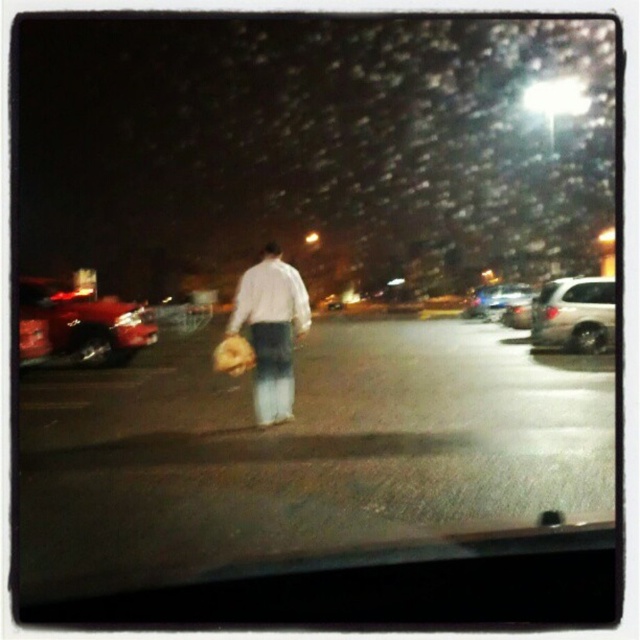
Question: Which point is closer to the camera taking this photo?

Choices:
 (A) (506, 321)
 (B) (556, 337)
 (C) (300, 296)
 (D) (20, 304)

Answer: (C)

Question: Estimate the real-world distances between objects in this image. Which object is farther from the satin silver suv at right?

Choices:
 (A) shiny red car at left
 (B) metallic silver sedan at right

Answer: (A)

Question: Which of the following is the closest to the observer?

Choices:
 (A) (548, 301)
 (B) (518, 310)
 (C) (32, 314)

Answer: (C)

Question: Is satin silver suv at right thinner than metallic silver sedan at right?

Choices:
 (A) yes
 (B) no

Answer: (B)

Question: Is the position of shiny red car at left less distant than that of satin silver suv at right?

Choices:
 (A) no
 (B) yes

Answer: (B)

Question: Can you confirm if shiny red car at left is smaller than satin silver suv at right?

Choices:
 (A) yes
 (B) no

Answer: (A)